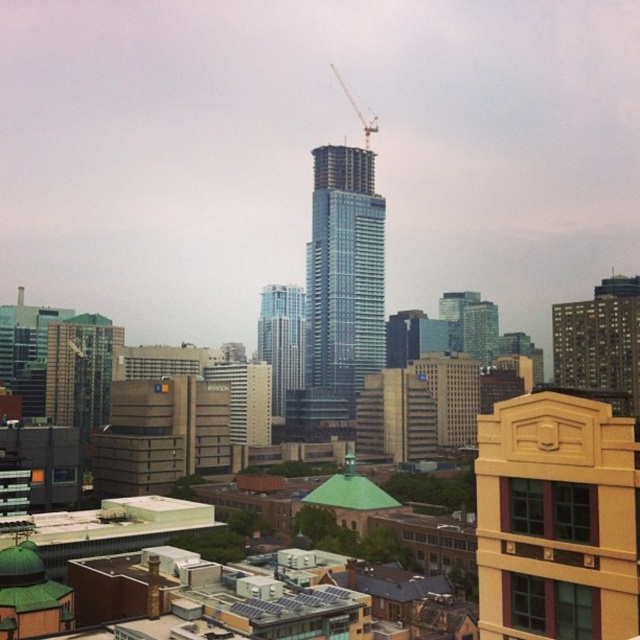
Based on the scene description, where is the matte glass building at left located in terms of its 2D coordinates?

The matte glass building at left is located at coordinates point (81, 371).

You are a city planner reviewing this area. You need to place a new park between the gold textured building at center and the dark gray concrete building at right. Based on their positions, which building should the park be closer to?

The park should be closer to the gold textured building at center because it is positioned to the left of the dark gray concrete building at right.

You are a city planner reviewing the architectural plans. The city requires that all new buildings must not block the view of the historic green dome buildings from the central park. Given the current positions of the matte glass building at left and the glassy blue skyscraper at center, which one is more likely to obstruct the view of the historic buildings?

The matte glass building at left is located below the glassy blue skyscraper at center. Since it is positioned lower, the glassy blue skyscraper at center would be taller and more likely to obstruct the view of the historic green dome buildings from the central park.